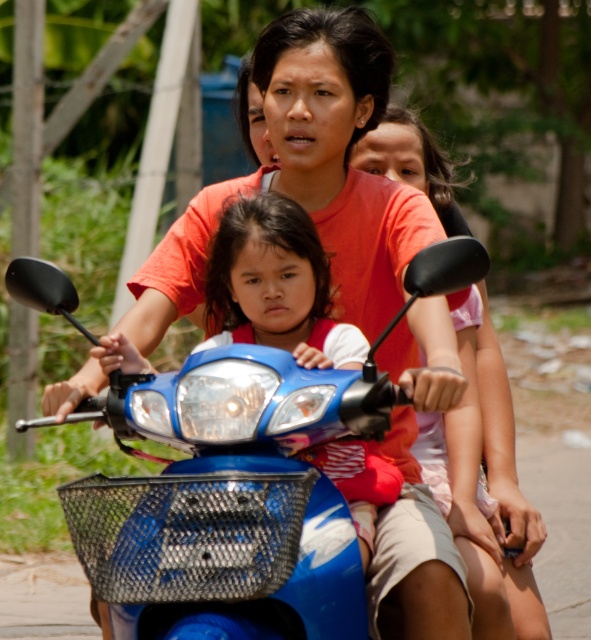
You are a pedestrian standing on the sidewalk and see the blue glossy motorcycle at center and the matte blue scooter at center. Which one is closer to you?

The blue glossy motorcycle at center is closer to you because it is in front of the matte blue scooter at center.

You are a photographer trying to capture the entire scene of the blue glossy motorcycle at center and the pink fabric shirt at center in one shot. Based on their sizes, will you need to zoom in or out to ensure both are fully visible?

The blue glossy motorcycle at center is wider than the pink fabric shirt at center. To capture both fully, you should zoom out to accommodate the motorcycle.

You are a pedestrian standing on the sidewalk. You see a pink fabric shirt at center and a matte blue scooter at center. Which one is closer to you?

The pink fabric shirt at center is closer to you because the matte blue scooter at center is behind it.